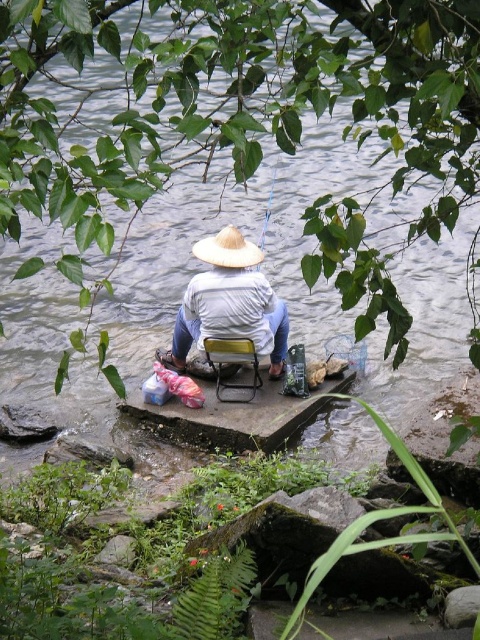
Is point (251, 358) closer to camera compared to point (259, 257)?

No, (251, 358) is behind (259, 257).

Is point (238, 355) positioned behind point (195, 243)?

No, (238, 355) is closer to viewer.

The height and width of the screenshot is (640, 480). Describe the element at coordinates (231, 362) in the screenshot. I see `yellow plastic chair at center` at that location.

You are a GUI agent. You are given a task and a screenshot of the screen. Output one action in this format:
    pyautogui.click(x=<x>, y=<y>)
    Task: Click on the yellow plastic chair at center
    This screenshot has width=480, height=640.
    Given the screenshot: What is the action you would take?
    pyautogui.click(x=231, y=362)